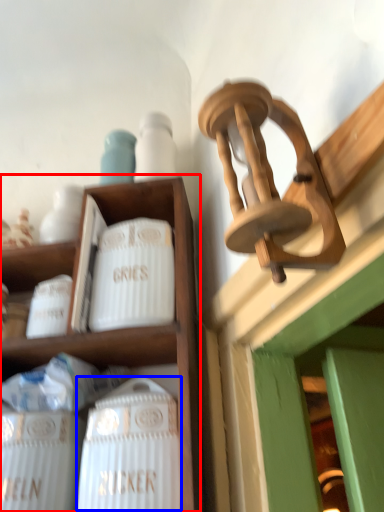
Question: Which point is closer to the camera, shelf (highlighted by a red box) or wine bottle (highlighted by a blue box)?

Choices:
 (A) shelf
 (B) wine bottle

Answer: (B)